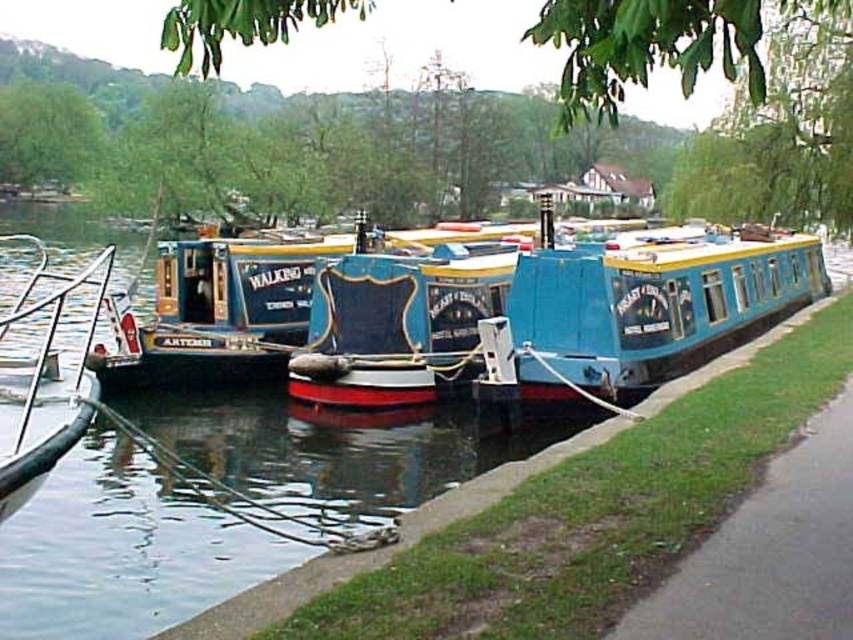
Can you confirm if blue matte houseboat at center is bigger than metallic silver boat at left?

No, blue matte houseboat at center is not bigger than metallic silver boat at left.

Who is lower down, blue matte houseboat at center or metallic silver boat at left?

metallic silver boat at left is below.

Identify the location of blue matte houseboat at center. (637, 310).

The image size is (853, 640). Find the location of `blue matte houseboat at center`. blue matte houseboat at center is located at coordinates click(x=637, y=310).